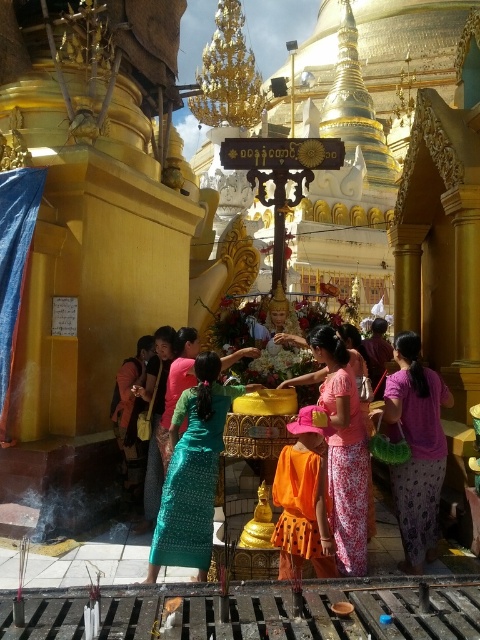
Can you confirm if pink fabric skirt at lower right is smaller than pink fabric dress at center?

Correct, pink fabric skirt at lower right occupies less space than pink fabric dress at center.

Can you confirm if pink fabric skirt at lower right is positioned to the right of pink fabric dress at center?

Indeed, pink fabric skirt at lower right is positioned on the right side of pink fabric dress at center.

The image size is (480, 640). I want to click on pink fabric skirt at lower right, so click(x=416, y=449).

At what (x,y) coordinates should I click in order to perform the action: click on pink fabric skirt at lower right. Please return your answer as a coordinate pair (x, y). The height and width of the screenshot is (640, 480). Looking at the image, I should click on (416, 449).

How far apart are pink fabric skirt at lower right and pink printed fabric at center?

They are 8.91 feet apart.

Is point (410, 452) positioned before point (362, 500)?

No, (410, 452) is behind (362, 500).

Is point (404, 388) closer to camera compared to point (342, 396)?

No, (404, 388) is behind (342, 396).

Locate an element on the screen. This screenshot has height=640, width=480. pink fabric skirt at lower right is located at coordinates (416, 449).

Which is above, pink fabric dress at center or orange fabric robe at center?

pink fabric dress at center

Which is below, pink fabric dress at center or orange fabric robe at center?

orange fabric robe at center

Who is more distant from viewer, (373, 515) or (314, 506)?

Positioned behind is point (373, 515).

This screenshot has height=640, width=480. I want to click on pink fabric dress at center, so click(344, 449).